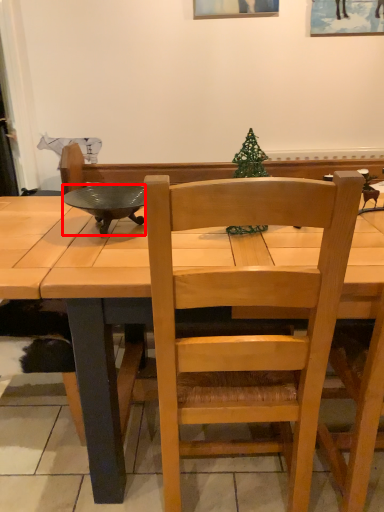
Question: From the image, what is the correct spatial relationship of bowl (annotated by the red box) in relation to chair?

Choices:
 (A) left
 (B) right

Answer: (A)